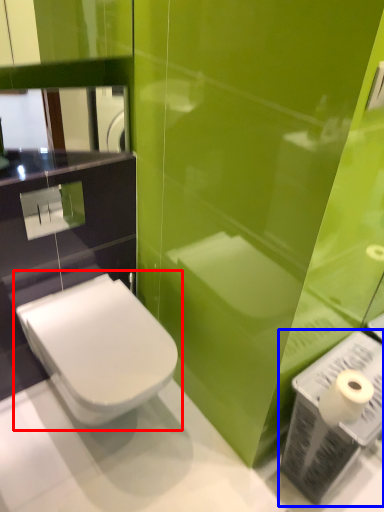
Question: Which object is closer to the camera taking this photo, toilet (highlighted by a red box) or toiletry (highlighted by a blue box)?

Choices:
 (A) toilet
 (B) toiletry

Answer: (B)